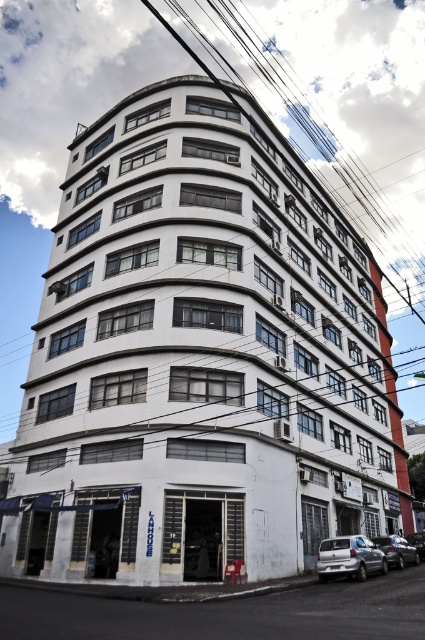
Who is positioned more to the right, white matte car at lower right or shiny black sedan at lower right?

Positioned to the right is shiny black sedan at lower right.

Is point (342, 552) positioned in front of point (421, 554)?

Yes, point (342, 552) is in front of point (421, 554).

Find the location of a particular element. This screenshot has height=640, width=425. white matte car at lower right is located at coordinates (348, 557).

Is black wire at upper center above shiny black sedan at lower right?

Yes, black wire at upper center is above shiny black sedan at lower right.

What are the coordinates of `black wire at upper center` in the screenshot? It's located at (190, 52).

Is point (422, 323) closer to viewer compared to point (421, 550)?

No.

Find the location of a particular element. black wire at upper center is located at coordinates (190, 52).

Is white matte car at lower right above black wire at upper center?

No.

Is white matte car at lower right positioned before black wire at upper center?

No, it is not.

At what (x,y) coordinates should I click in order to perform the action: click on white matte car at lower right. Please return your answer as a coordinate pair (x, y). Looking at the image, I should click on (348, 557).